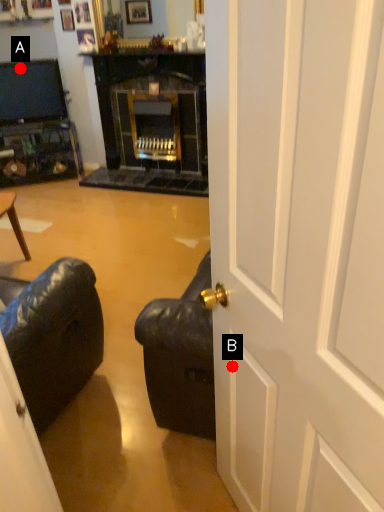
Question: Two points are circled on the image, labeled by A and B beside each circle. Which point appears closest to the camera in this image?

Choices:
 (A) A is closer
 (B) B is closer

Answer: (B)